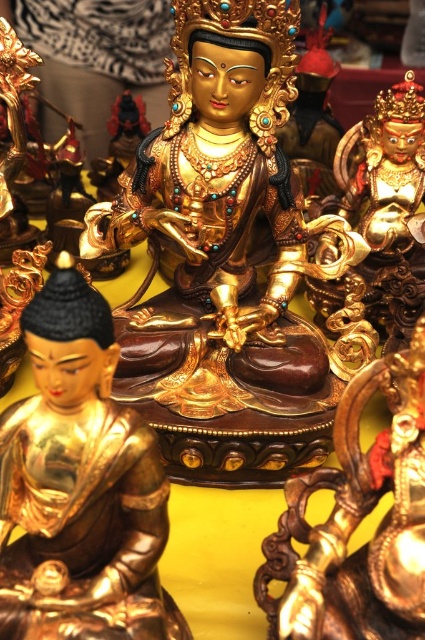
Image resolution: width=425 pixels, height=640 pixels. What do you see at coordinates (79, 484) in the screenshot?
I see `gold polished statue at lower left` at bounding box center [79, 484].

From the picture: Who is taller, gold polished statue at lower left or gold polished statue at center?

gold polished statue at lower left is taller.

The width and height of the screenshot is (425, 640). I want to click on gold polished statue at lower left, so click(79, 484).

Where is `gold polished statue at lower left`? The width and height of the screenshot is (425, 640). gold polished statue at lower left is located at coordinates (79, 484).

Where is `gold/gilded statue at center`? This screenshot has height=640, width=425. gold/gilded statue at center is located at coordinates (223, 227).

Who is taller, gold/gilded statue at center or gold polished statue at lower left?

With more height is gold/gilded statue at center.

This screenshot has height=640, width=425. What do you see at coordinates (223, 227) in the screenshot? I see `gold/gilded statue at center` at bounding box center [223, 227].

In order to click on gold/gilded statue at center in this screenshot , I will do `click(223, 227)`.

How much distance is there between gold/gilded statue at center and gold polished statue at center?

gold/gilded statue at center and gold polished statue at center are 13.86 inches apart from each other.

Which is below, gold/gilded statue at center or gold polished statue at center?

Positioned lower is gold polished statue at center.

Where is `gold/gilded statue at center`? Image resolution: width=425 pixels, height=640 pixels. gold/gilded statue at center is located at coordinates pos(223,227).